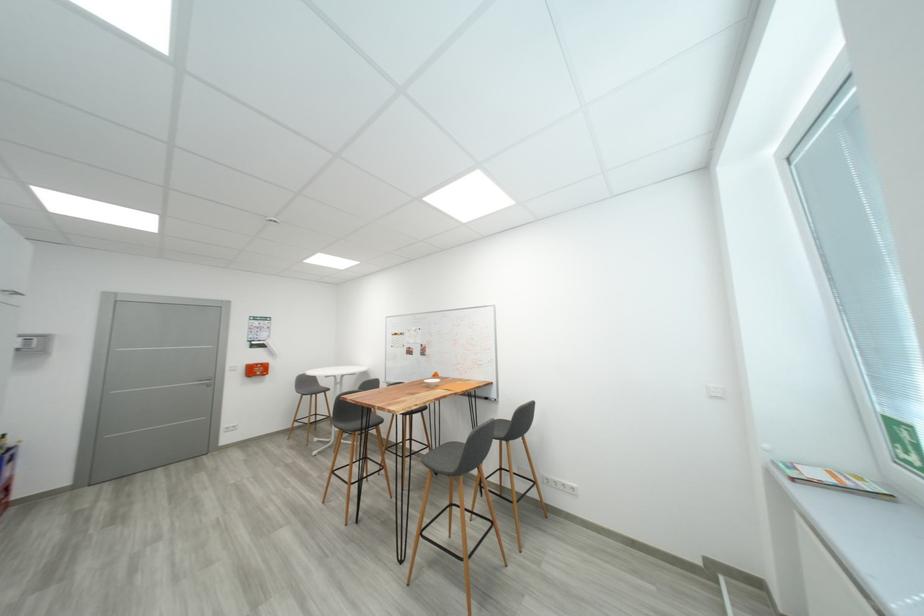
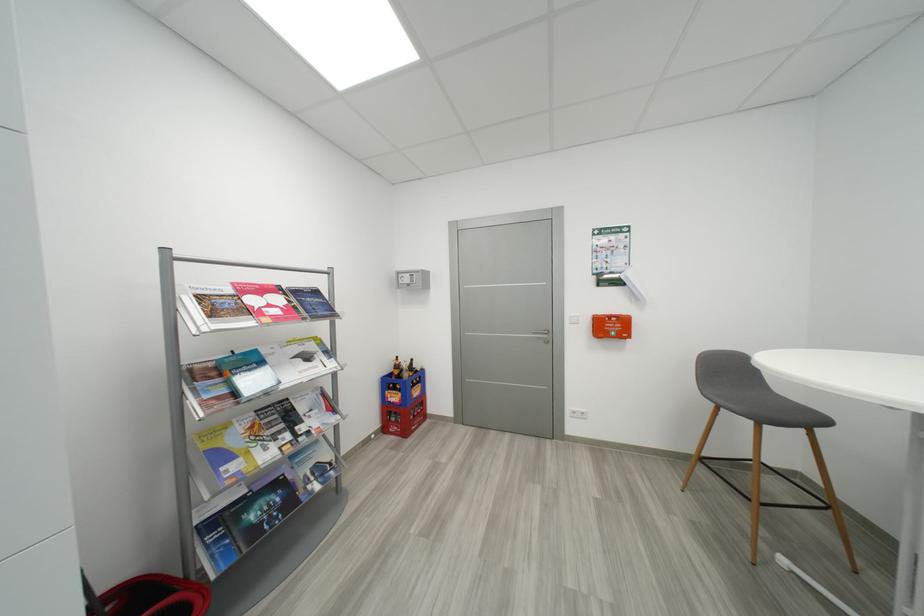
Locate, in the second image, the point that corresponds to point 215,387 in the first image.

(553, 344)